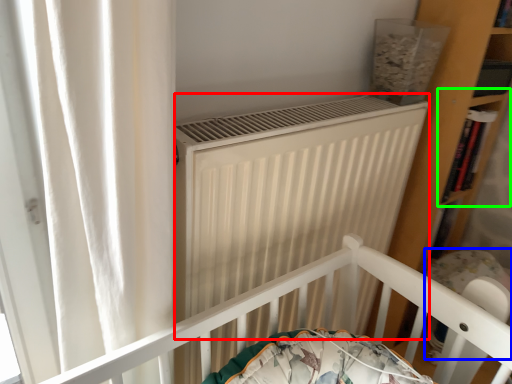
Question: Which object is positioned farthest from heater (highlighted by a red box)? Select from baby carriage (highlighted by a blue box) and shelf (highlighted by a green box).

Choices:
 (A) baby carriage
 (B) shelf

Answer: (B)